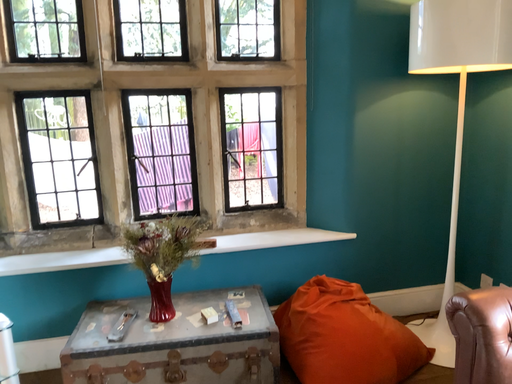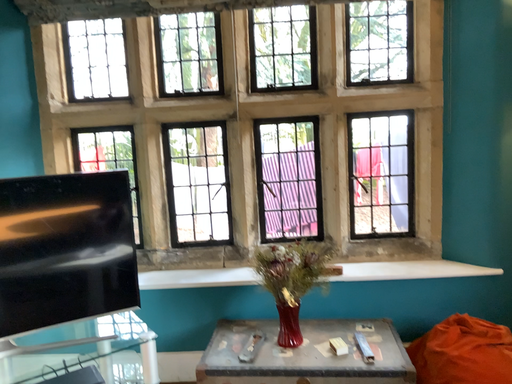
Question: How did the camera likely rotate when shooting the video?

Choices:
 (A) rotated left
 (B) rotated right

Answer: (A)